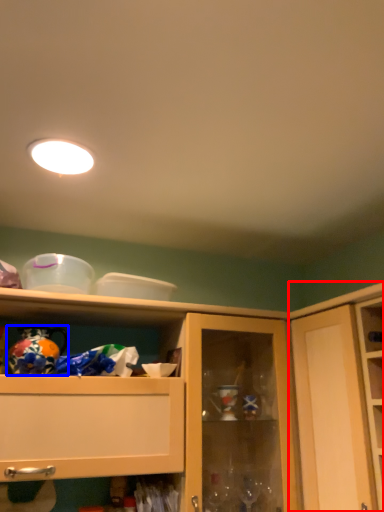
Question: Which object appears closest to the camera in this image, cupboard (highlighted by a red box) or toy (highlighted by a blue box)?

Choices:
 (A) cupboard
 (B) toy

Answer: (A)